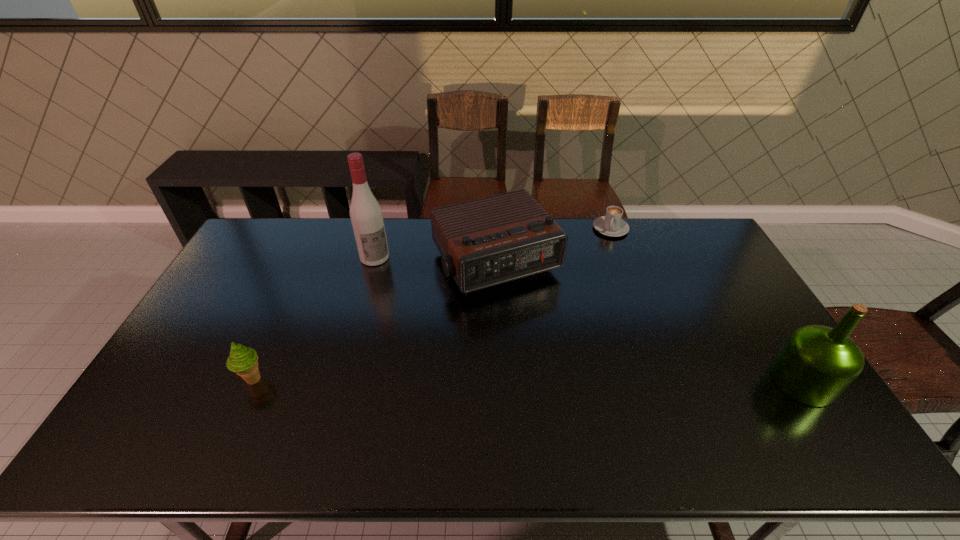
Where is `icecream`? This screenshot has width=960, height=540. icecream is located at coordinates [x=243, y=361].

Image resolution: width=960 pixels, height=540 pixels. Find the location of `the leftmost object`. the leftmost object is located at coordinates (243, 361).

Locate an element on the screen. olive oil is located at coordinates (817, 363).

Locate an element on the screen. Image resolution: width=960 pixels, height=540 pixels. the rightmost object is located at coordinates (817, 363).

Where is `the second object from left to right`? The image size is (960, 540). the second object from left to right is located at coordinates (366, 216).

I want to click on the tallest object, so click(x=366, y=216).

This screenshot has height=540, width=960. I want to click on the third object from right to left, so click(x=489, y=241).

This screenshot has width=960, height=540. What are the coordinates of `radio receiver` in the screenshot? It's located at (489, 241).

Identify the location of the shortest object. The image size is (960, 540). (611, 224).

At what (x,y) coordinates should I click in order to perform the action: click on cappuccino. Please return your answer as a coordinate pair (x, y). The image size is (960, 540). Looking at the image, I should click on (611, 224).